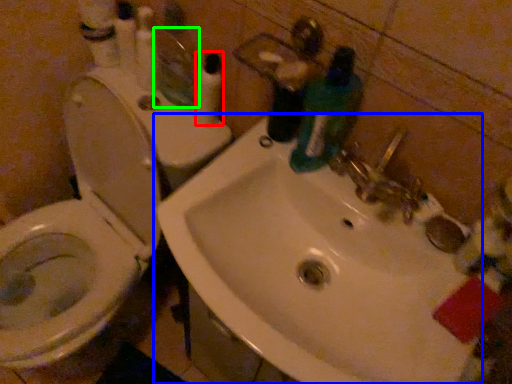
Question: Considering the real-world distances, which object is closest to toiletry (highlighted by a red box)? sink (highlighted by a blue box) or mirror (highlighted by a green box).

Choices:
 (A) sink
 (B) mirror

Answer: (B)